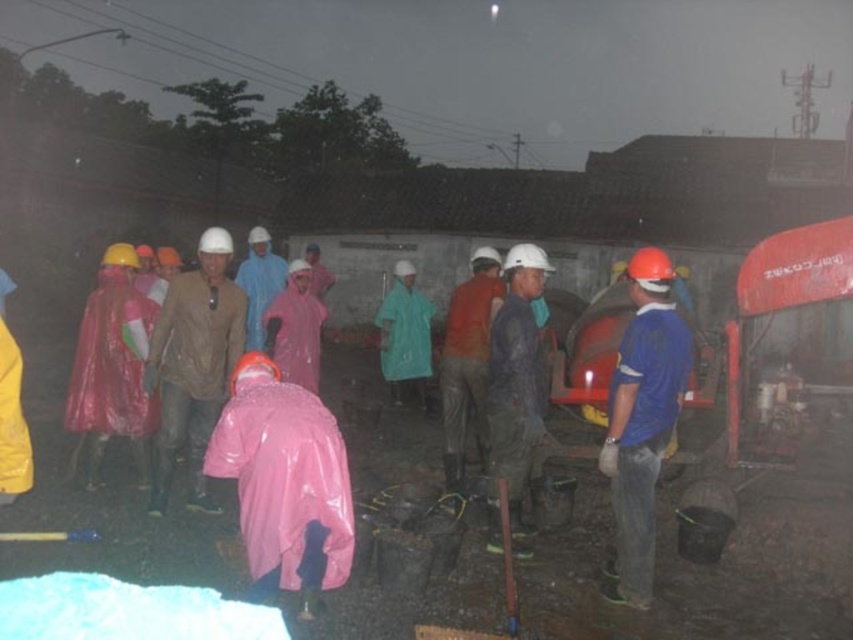
Between matte brown jacket at center and wet fabric helmet at center, which one has more height?

matte brown jacket at center is taller.

Does matte brown jacket at center appear on the right side of wet fabric helmet at center?

Incorrect, matte brown jacket at center is not on the right side of wet fabric helmet at center.

Is point (178, 417) farther from camera compared to point (527, 413)?

Yes, point (178, 417) is farther from viewer.

At what (x,y) coordinates should I click in order to perform the action: click on matte brown jacket at center. Please return your answer as a coordinate pair (x, y). The image size is (853, 640). Looking at the image, I should click on (193, 364).